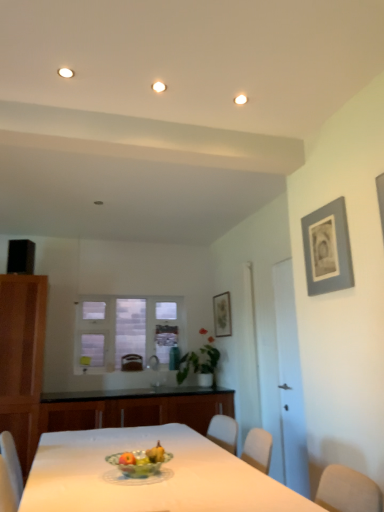
Question: From the image's perspective, is gray matte picture frame at upper right, the 1th picture frame in the right-to-left sequence, located above or below brown leather armchair at center?

Choices:
 (A) above
 (B) below

Answer: (A)

Question: Is gray matte picture frame at upper right, the 1th picture frame in the right-to-left sequence, wider or thinner than brown leather armchair at center?

Choices:
 (A) wide
 (B) thin

Answer: (B)

Question: Estimate the real-world distances between objects in this image. Which object is closer to the green glass bowl at center?

Choices:
 (A) white glass window at center
 (B) white glossy table at center
 (C) black granite countertop at center
 (D) white glossy door at right
 (E) brown leather armchair at center

Answer: (B)

Question: Considering the real-world distances, which object is closest to the brown leather armchair at center?

Choices:
 (A) white glass window at center
 (B) white glossy table at center
 (C) matte gray picture frame at upper center, the 1th picture frame when ordered from back to front
 (D) gray matte picture frame at upper right, marked as the second picture frame in a left-to-right arrangement
 (E) green glass bowl at center

Answer: (A)